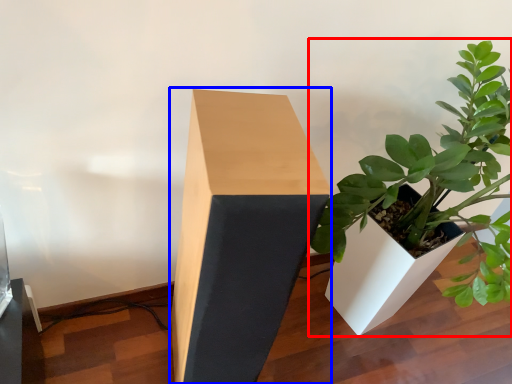
Question: Among these objects, which one is farthest to the camera, houseplant (highlighted by a red box) or table (highlighted by a blue box)?

Choices:
 (A) houseplant
 (B) table

Answer: (B)